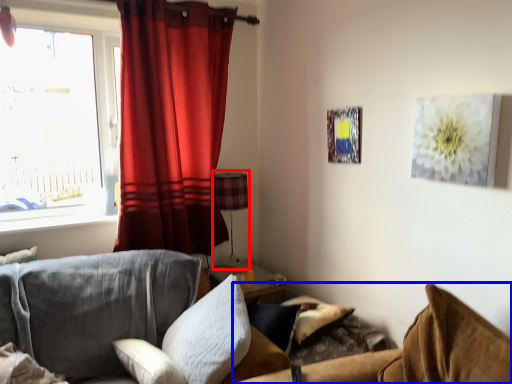
Question: Which object appears closest to the camera in this image, lamp (highlighted by a red box) or couch (highlighted by a blue box)?

Choices:
 (A) lamp
 (B) couch

Answer: (B)